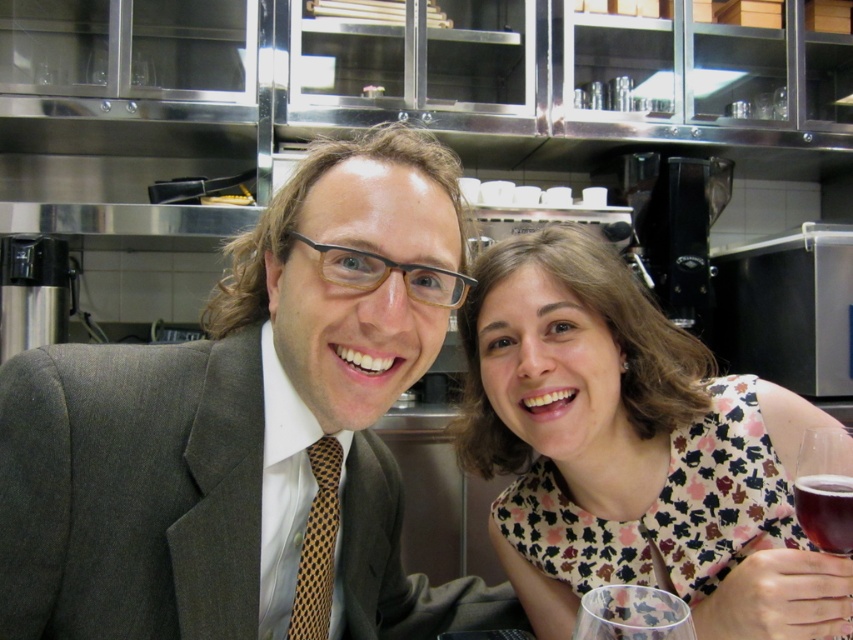
Question: Estimate the real-world distances between objects in this image. Which object is closer to the brown dotted tie at left?

Choices:
 (A) floral-patterned dress at center
 (B) translucent glass wine at right

Answer: (A)

Question: Among these objects, which one is farthest from the camera?

Choices:
 (A) brown dotted tie at left
 (B) matte gray suit at center
 (C) transparent plastic wine glass at lower right

Answer: (A)

Question: Does matte gray suit at center appear on the right side of translucent glass wine at right?

Choices:
 (A) no
 (B) yes

Answer: (A)

Question: Which object appears farthest from the camera in this image?

Choices:
 (A) transparent plastic wine glass at lower right
 (B) floral-patterned dress at center
 (C) translucent glass wine at right
 (D) brown dotted tie at left

Answer: (D)

Question: Is floral-patterned dress at center to the right of transparent plastic wine glass at lower right from the viewer's perspective?

Choices:
 (A) yes
 (B) no

Answer: (A)

Question: Can you confirm if brown dotted tie at left is positioned below transparent plastic wine glass at lower right?

Choices:
 (A) no
 (B) yes

Answer: (A)